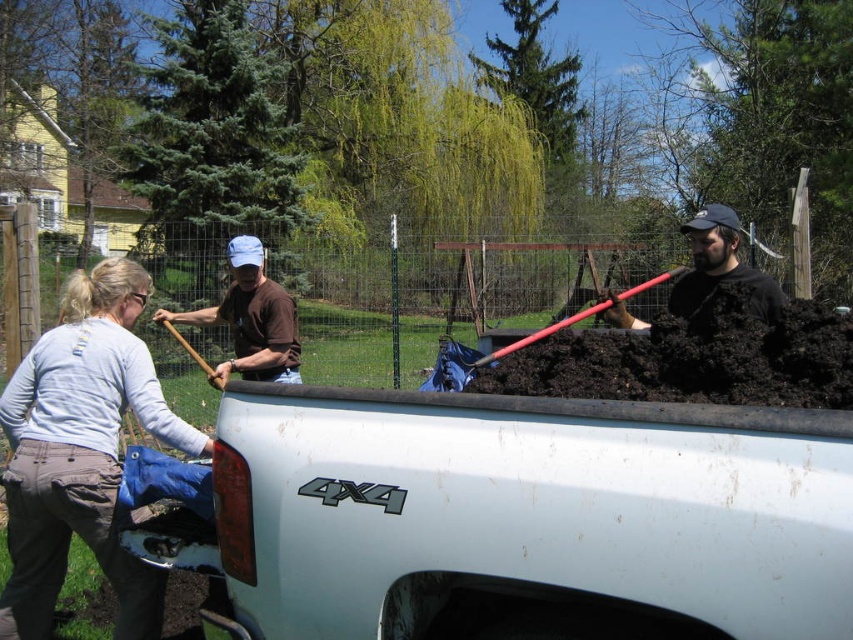
What do you see at coordinates (82, 451) in the screenshot?
I see `light blue cotton shirt at left` at bounding box center [82, 451].

Does light blue cotton shirt at left have a larger size compared to brown cotton shirt at upper center?

Correct, light blue cotton shirt at left is larger in size than brown cotton shirt at upper center.

Which is in front, point (138, 609) or point (287, 381)?

Point (138, 609) is more forward.

Find the location of a particular element. light blue cotton shirt at left is located at coordinates (82, 451).

Can you confirm if light blue cotton shirt at left is taller than matte black shovel at center?

Yes.

From the picture: Who is shorter, light blue cotton shirt at left or matte black shovel at center?

matte black shovel at center

The image size is (853, 640). What do you see at coordinates (82, 451) in the screenshot?
I see `light blue cotton shirt at left` at bounding box center [82, 451].

In order to click on light blue cotton shirt at left in this screenshot , I will do coord(82,451).

Can you confirm if brown cotton shirt at upper center is positioned above matte black shovel at center?

Actually, brown cotton shirt at upper center is below matte black shovel at center.

Who is positioned more to the left, brown cotton shirt at upper center or matte black shovel at center?

Positioned to the left is brown cotton shirt at upper center.

Which is in front, point (270, 305) or point (602, 298)?

Positioned in front is point (270, 305).

Where is `brown cotton shirt at upper center`? brown cotton shirt at upper center is located at coordinates (251, 317).